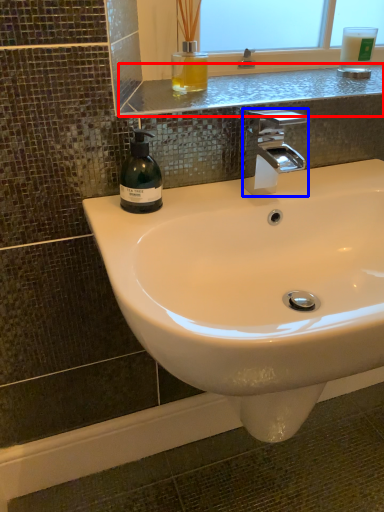
Question: Which of the following is the farthest to the observer, window sill (highlighted by a red box) or tap (highlighted by a blue box)?

Choices:
 (A) window sill
 (B) tap

Answer: (A)